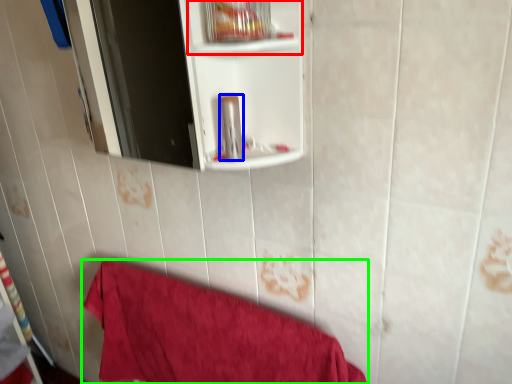
Question: Which object is the farthest from cabinet (highlighted by a red box)? Choose among these: toiletry (highlighted by a blue box) or towel (highlighted by a green box).

Choices:
 (A) toiletry
 (B) towel

Answer: (B)